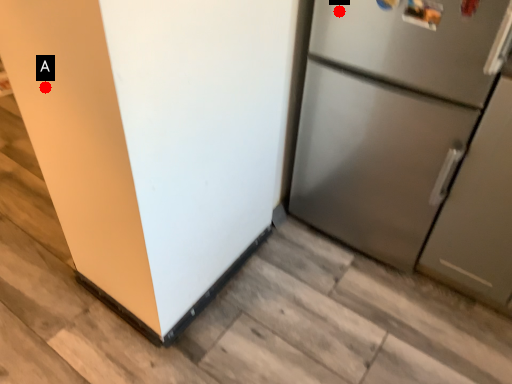
Question: Two points are circled on the image, labeled by A and B beside each circle. Which of the following is the farthest from the observer?

Choices:
 (A) A is further
 (B) B is further

Answer: (B)